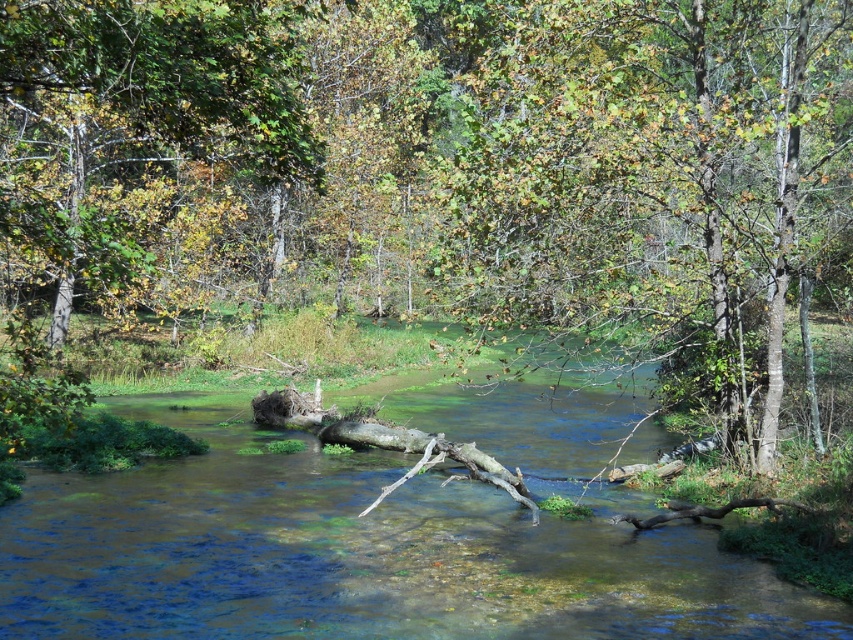
You are a hiker who needs to cross the stream. You see the clear water at center and the green leafy tree at upper center. How far apart are these two landmarks?

The clear water at center and the green leafy tree at upper center are 5.41 meters apart.

You are standing at the edge of the stream and want to take a photo of both the clear water at center and the green leafy tree at upper center. Which object will appear larger in your photo?

The clear water at center will appear larger in the photo because it is closer to the viewer than the green leafy tree at upper center.